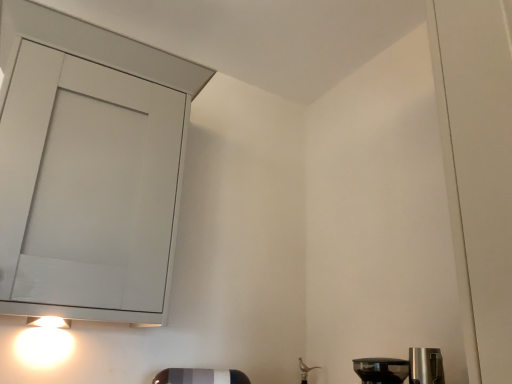
Question: Does point (399, 379) appear closer or farther from the camera than point (114, 283)?

Choices:
 (A) closer
 (B) farther

Answer: (A)

Question: In the image, is transparent plastic coffee maker at lower right on the left side or the right side of matte white cabinet at upper left?

Choices:
 (A) left
 (B) right

Answer: (B)

Question: Which is farther from the transparent plastic coffee maker at lower right?

Choices:
 (A) matte white cabinet at upper left
 (B) white glossy light at lower left

Answer: (B)

Question: Which of these objects is positioned farthest from the white glossy light at lower left?

Choices:
 (A) matte white cabinet at upper left
 (B) transparent plastic coffee maker at lower right

Answer: (B)